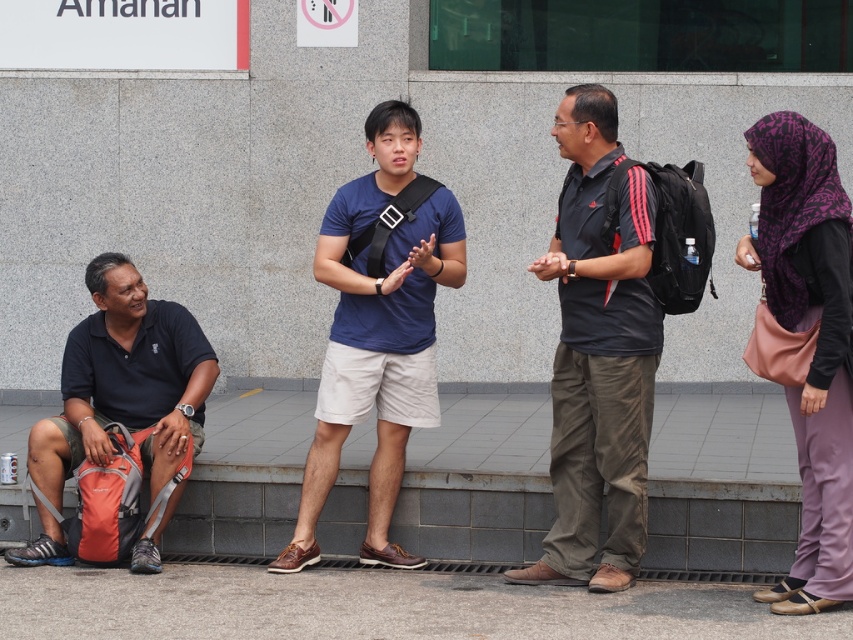
Question: Among these objects, which one is nearest to the camera?

Choices:
 (A) black fabric backpack at lower left
 (B) black matte shirt at center
 (C) gray concrete pavement at lower center
 (D) blue cotton t-shirt at center

Answer: (C)

Question: Does black matte shirt at center have a larger size compared to purple printed hijab at upper right?

Choices:
 (A) yes
 (B) no

Answer: (A)

Question: Is purple printed hijab at upper right bigger than black fabric backpack at lower left?

Choices:
 (A) yes
 (B) no

Answer: (B)

Question: Estimate the real-world distances between objects in this image. Which object is farther from the black matte shirt at center?

Choices:
 (A) purple printed hijab at upper right
 (B) gray concrete pavement at lower center
 (C) blue cotton t-shirt at center

Answer: (B)

Question: Which of the following is the farthest from the observer?

Choices:
 (A) (170, 356)
 (B) (607, 512)
 (C) (244, 566)
 (D) (399, 140)

Answer: (A)

Question: Is black matte shirt at center thinner than black fabric backpack at lower left?

Choices:
 (A) no
 (B) yes

Answer: (B)